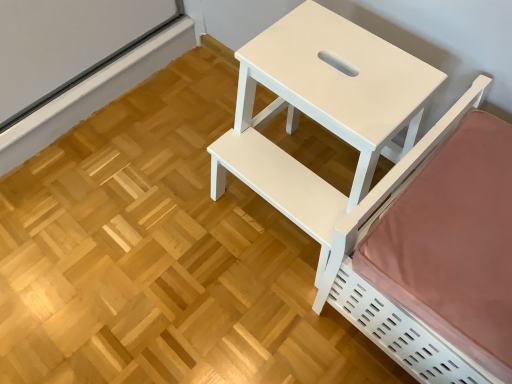
Where is `vacant area to the left of white matte table at center`? Image resolution: width=512 pixels, height=384 pixels. vacant area to the left of white matte table at center is located at coordinates (178, 225).